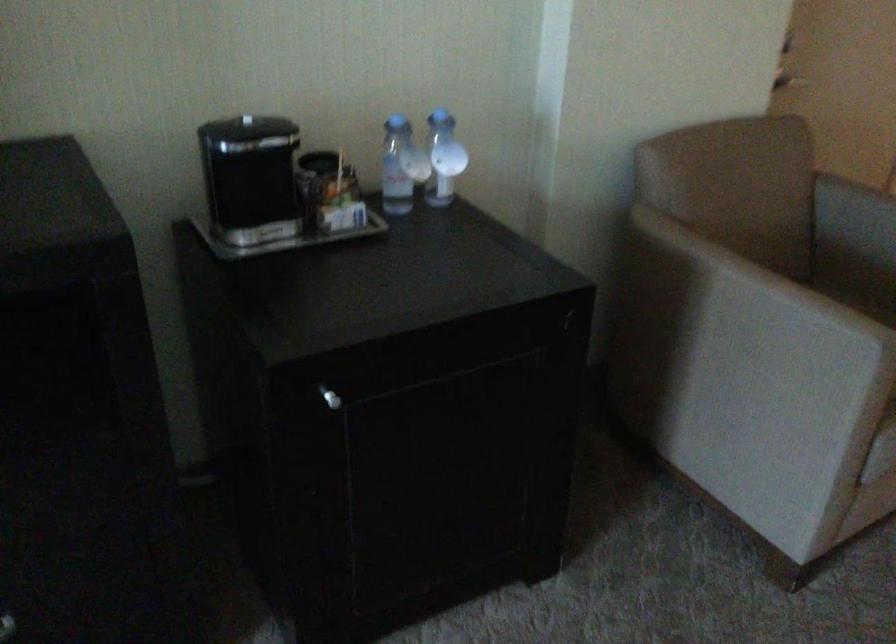
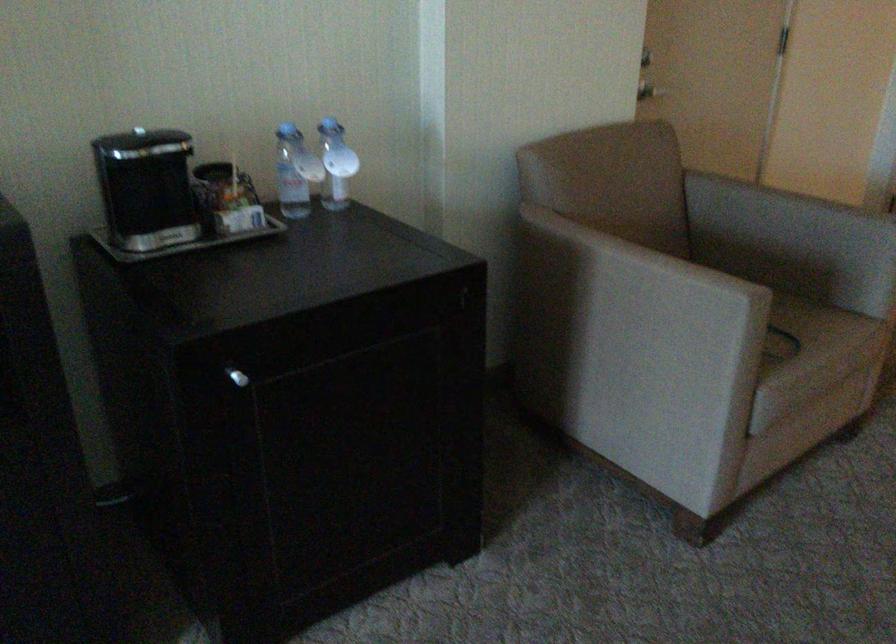
Locate, in the second image, the point that corresponds to point 317,162 in the first image.

(212, 171)